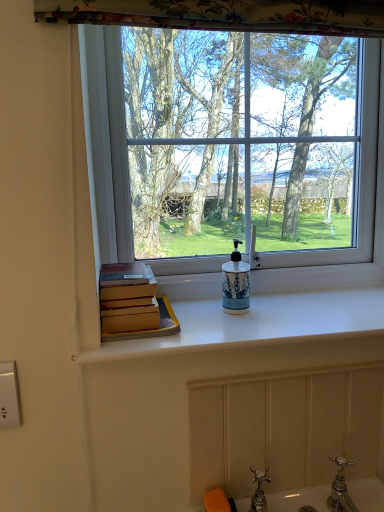
Question: Is point (360, 168) positioned closer to the camera than point (124, 273)?

Choices:
 (A) closer
 (B) farther

Answer: (B)

Question: From a real-world perspective, relative to hardcover books at left, is transparent glass window at center vertically above or below?

Choices:
 (A) below
 (B) above

Answer: (B)

Question: Estimate the real-world distances between objects in this image. Which object is farther from the hardcover books at left?

Choices:
 (A) white glossy counter top at center
 (B) white plastic electric outlet at lower left
 (C) blue and white ceramic soap dispenser at center
 (D) transparent glass window at center

Answer: (B)

Question: Considering the real-world distances, which object is farthest from the white glossy counter top at center?

Choices:
 (A) white plastic electric outlet at lower left
 (B) blue and white ceramic soap dispenser at center
 (C) hardcover books at left
 (D) transparent glass window at center

Answer: (A)